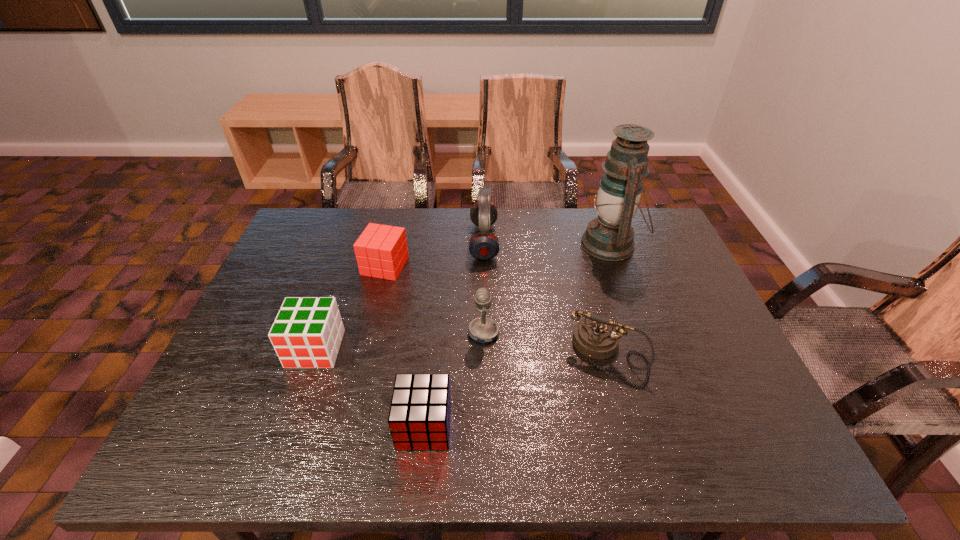
Find the location of a particular element. blank area located 0.180m on the ear cups of the sixth shortest object is located at coordinates (412, 241).

You are a GUI agent. You are given a task and a screenshot of the screen. Output one action in this format:
    pyautogui.click(x=<x>, y=<y>)
    Task: Click on the free spot located 0.080m on the ear cups of the sixth shortest object
    The height and width of the screenshot is (540, 960).
    Given the screenshot: What is the action you would take?
    pyautogui.click(x=444, y=241)

In order to click on free space located on the front-facing side of the third tallest object in this screenshot , I will do `click(396, 333)`.

Locate an element on the screen. vacant space located 0.150m on the front-facing side of the third tallest object is located at coordinates (408, 333).

Locate an element on the screen. vacant space positioned on the front-facing side of the third tallest object is located at coordinates (360, 333).

This screenshot has height=540, width=960. Identify the location of free spot located on the red face of the second farthest cube. (295, 407).

Identify the location of free space located on the right of the telephone. (722, 355).

Locate an element on the screen. free space located on the right of the farthest cube is located at coordinates (466, 266).

Where is `vacant region located on the right of the nearest object`? vacant region located on the right of the nearest object is located at coordinates (551, 426).

Where is `oil lamp positioned at the far edge`? oil lamp positioned at the far edge is located at coordinates 609,237.